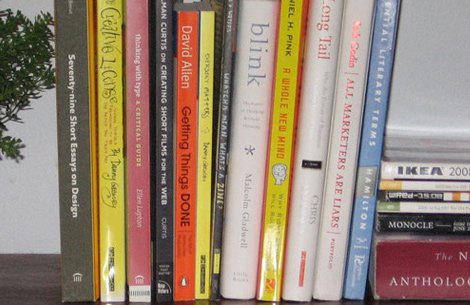
The width and height of the screenshot is (470, 305). Identify the location of books. (320, 43).